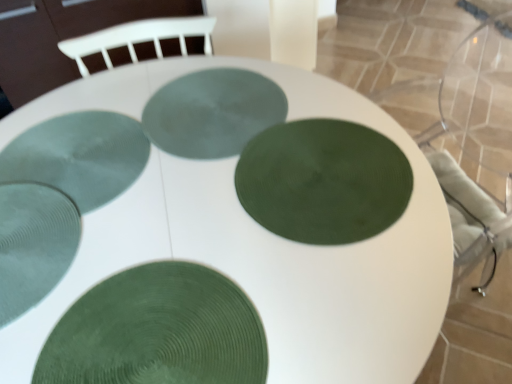
Where is `free space between green textured glass plate at center, which ranks as the third glass plate in front-to-back order, and green textured glass plate at center, which is the 1th glass plate in back-to-front order`? free space between green textured glass plate at center, which ranks as the third glass plate in front-to-back order, and green textured glass plate at center, which is the 1th glass plate in back-to-front order is located at coordinates (237, 156).